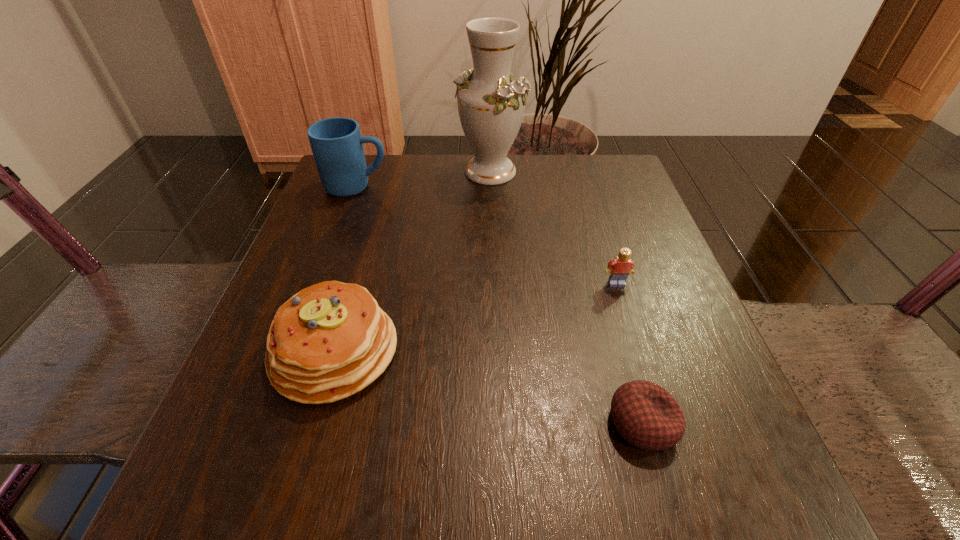
At what (x,y) coordinates should I click in order to perform the action: click on blank region between the third tallest object and the tallest object. Please return your answer as a coordinate pair (x, y). Looking at the image, I should click on (412, 261).

Where is `free space between the third object from right to left and the beanbag`? The width and height of the screenshot is (960, 540). free space between the third object from right to left and the beanbag is located at coordinates (566, 297).

The height and width of the screenshot is (540, 960). I want to click on free spot between the Lego and the shortest object, so point(630,353).

Locate an element on the screen. free spot between the third farthest object and the shortest object is located at coordinates (630, 353).

This screenshot has width=960, height=540. What are the coordinates of `free spot between the fourth shortest object and the fourth tallest object` in the screenshot? It's located at (487, 235).

Find the location of a particular element. The image size is (960, 540). free spot between the third object from left to right and the shortest object is located at coordinates (566, 297).

Identify the location of free space between the beanbag and the third tallest object. This screenshot has width=960, height=540. (489, 387).

Locate an element on the screen. The width and height of the screenshot is (960, 540). free area in between the mug and the pancake is located at coordinates (346, 269).

Find the location of a particular element. the fourth closest object relative to the pancake is located at coordinates [491, 104].

Identify which object is the third closest to the third object from left to right. Please provide its 2D coordinates. Your answer should be formatted as a tuple, i.e. [(x, y)], where the tuple contains the x and y coordinates of a point satisfying the conditions above.

[(329, 341)]